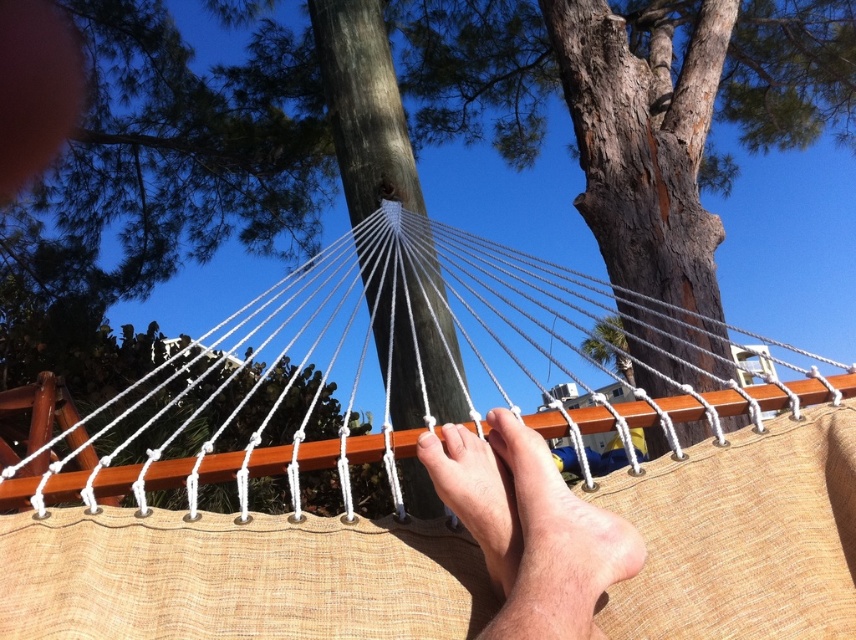
Looking at this image, you are standing at the point with coordinates point (x=93, y=481) and want to walk to the point with coordinates point (x=602, y=570). Can you see the destination point from your current position?

Point (x=93, y=481) is behind point (x=602, y=570), so you cannot see the destination point from your current position.